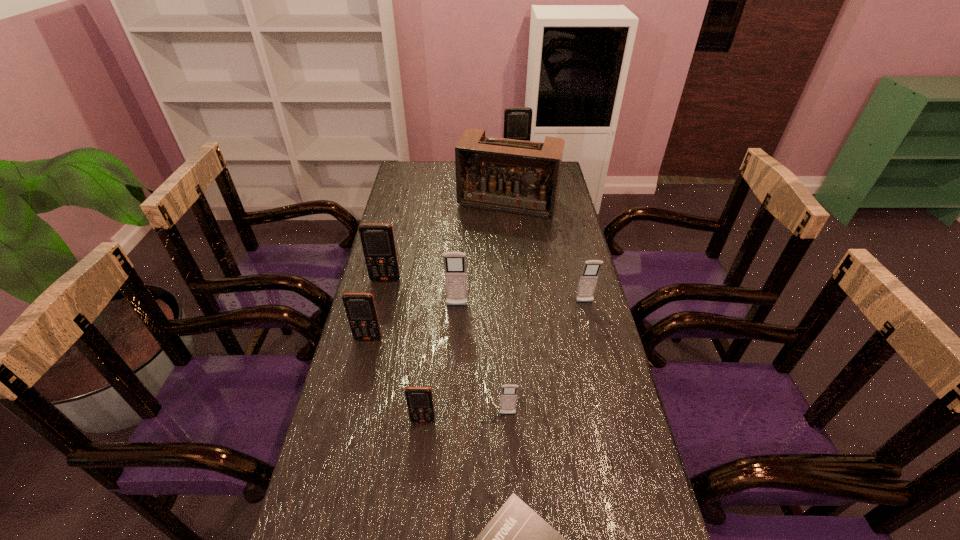
Image resolution: width=960 pixels, height=540 pixels. I want to click on the second closest cellular telephone to the smallest gray cellular telephone, so click(x=455, y=268).

At what (x,y) coordinates should I click in order to perform the action: click on cellular telephone that stands as the fourth closest to the third smallest orange cellular telephone. Please return your answer as a coordinate pair (x, y). The width and height of the screenshot is (960, 540). Looking at the image, I should click on (508, 397).

Where is `orange cellular telephone object that ranks as the closest to the fifth cellular telephone from right to left`? orange cellular telephone object that ranks as the closest to the fifth cellular telephone from right to left is located at coordinates (360, 308).

Where is `orange cellular telephone object that ranks as the second closest to the third nearest orange cellular telephone`? The image size is (960, 540). orange cellular telephone object that ranks as the second closest to the third nearest orange cellular telephone is located at coordinates (419, 400).

I want to click on gray cellular telephone that stands as the closest to the third farthest orange cellular telephone, so click(x=455, y=268).

Locate which gray cellular telephone is the closest to the farthest cellular telephone. Please provide its 2D coordinates. Your answer should be formatted as a tuple, i.e. [(x, y)], where the tuple contains the x and y coordinates of a point satisfying the conditions above.

[(588, 279)]